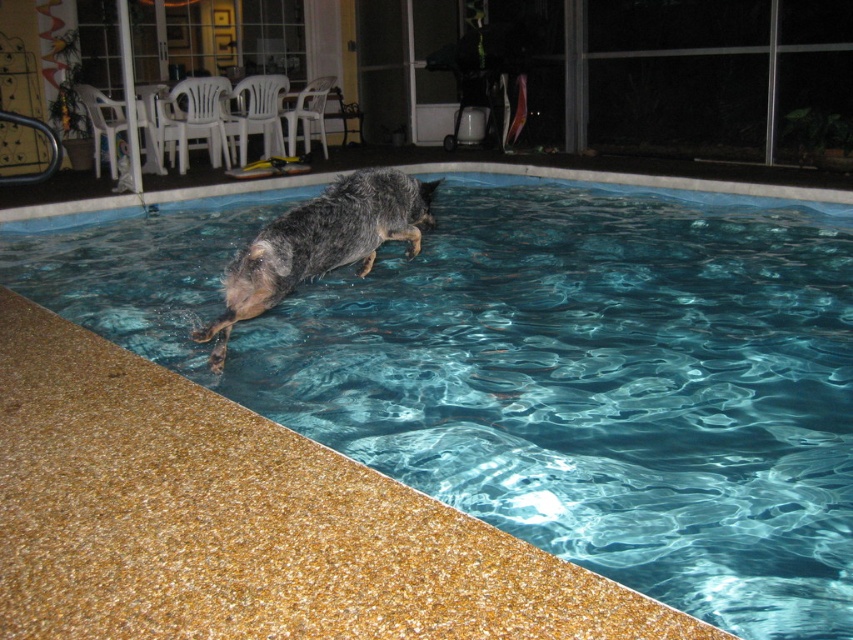
Who is higher up, clear blue water at center or wet fur dog at center?

clear blue water at center is above.

Does clear blue water at center have a smaller size compared to wet fur dog at center?

Incorrect, clear blue water at center is not smaller in size than wet fur dog at center.

Who is more distant from viewer, (822, 541) or (374, 204)?

The point (374, 204) is more distant.

The image size is (853, 640). I want to click on clear blue water at center, so click(541, 369).